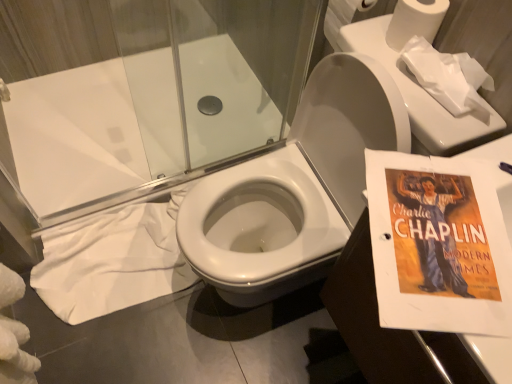
Question: Looking at the image, does white matte toilet paper at upper right, the second toilet paper viewed from the front, seem bigger or smaller compared to transparent glass shower door at upper center?

Choices:
 (A) small
 (B) big

Answer: (A)

Question: From the image's perspective, is white matte toilet paper at upper right, the second toilet paper viewed from the front, positioned above or below transparent glass shower door at upper center?

Choices:
 (A) below
 (B) above

Answer: (B)

Question: Based on their relative distances, which object is nearer to the white fabric at lower left?

Choices:
 (A) transparent glass shower door at upper center
 (B) white matte toilet paper at upper right, which is the 2th toilet paper from back to front
 (C) matte paper charlie chaplin poster at right
 (D) white paper at upper right, which appears as the 1th toilet paper when viewed from the front
 (E) white paper at upper right, which is counted as the third toilet paper, starting from the front

Answer: (A)

Question: Estimate the real-world distances between objects in this image. Which object is closer to the white matte toilet paper at upper right, which is the 2th toilet paper from back to front?

Choices:
 (A) transparent glass shower door at upper center
 (B) white fabric at lower left
 (C) white paper at upper right, which is counted as the third toilet paper, starting from the front
 (D) white paper at upper right, which appears as the 1th toilet paper when viewed from the front
 (E) matte paper charlie chaplin poster at right

Answer: (D)